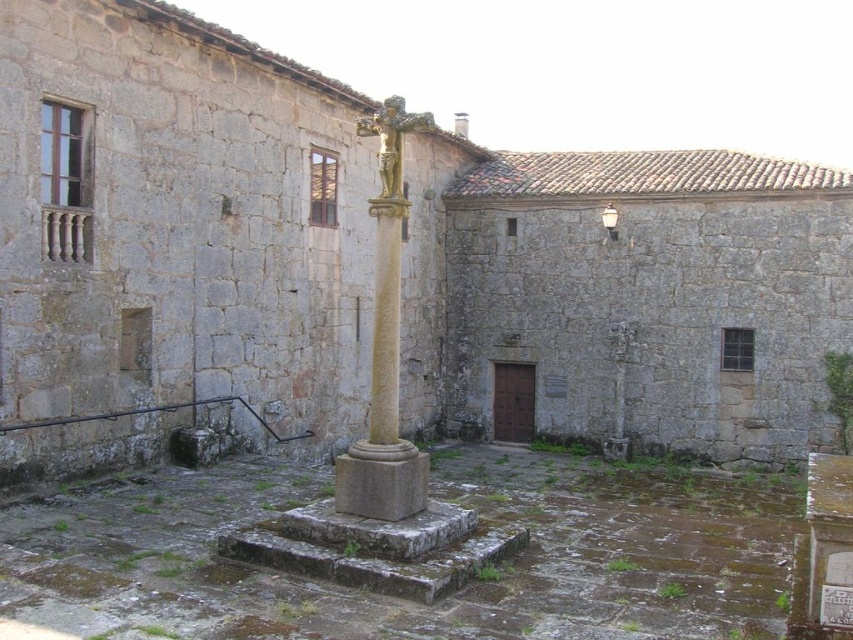
Question: Can you confirm if smooth stone cross at center is positioned to the right of white ceramic lamp post at upper center?

Choices:
 (A) yes
 (B) no

Answer: (B)

Question: Considering the relative positions of smooth stone cross at center and white ceramic lamp post at upper center in the image provided, where is smooth stone cross at center located with respect to white ceramic lamp post at upper center?

Choices:
 (A) above
 (B) below

Answer: (B)

Question: In this image, where is smooth stone cross at center located relative to white ceramic lamp post at upper center?

Choices:
 (A) left
 (B) right

Answer: (A)

Question: Which point is farther to the camera?

Choices:
 (A) smooth stone cross at center
 (B) white ceramic lamp post at upper center

Answer: (B)